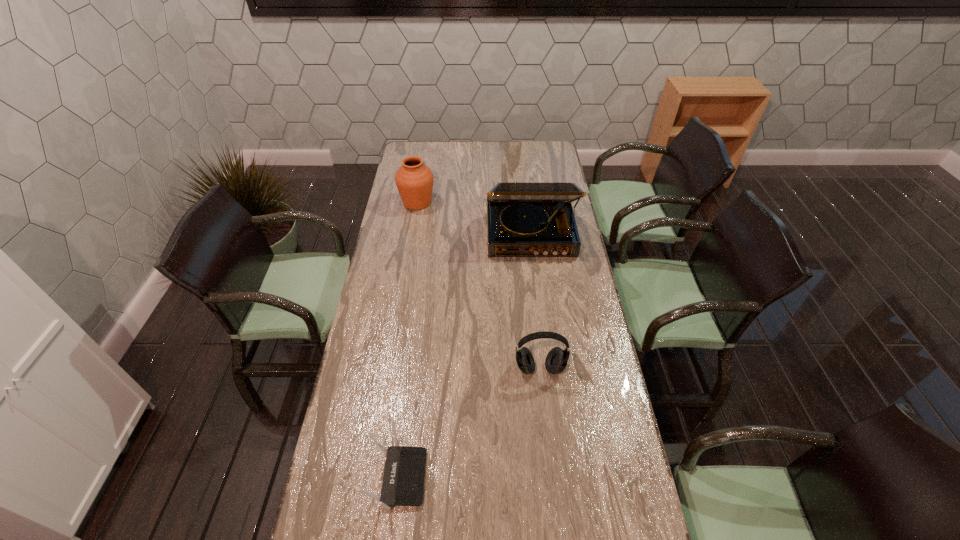
At what (x,y) coordinates should I click in order to perform the action: click on object that is the nearest to the farthest object. Please return your answer as a coordinate pair (x, y). Looking at the image, I should click on (524, 219).

Choose which object is the second nearest neighbor to the urn. Please provide its 2D coordinates. Your answer should be formatted as a tuple, i.e. [(x, y)], where the tuple contains the x and y coordinates of a point satisfying the conditions above.

[(556, 361)]

At what (x,y) coordinates should I click in order to perform the action: click on free region that satisfies the following two spatial constraints: 1. on the ear cups of the third farthest object; 2. on the front-facing side of the nearest object. Please return your answer as a coordinate pair (x, y). The image size is (960, 540). Looking at the image, I should click on (552, 477).

Locate an element on the screen. This screenshot has height=540, width=960. free space that satisfies the following two spatial constraints: 1. on the front-facing side of the tallest object; 2. on the front-facing side of the nearest object is located at coordinates (560, 477).

This screenshot has width=960, height=540. I want to click on free space that satisfies the following two spatial constraints: 1. on the ear cups of the second nearest object; 2. on the front-facing side of the router, so click(552, 477).

Locate an element on the screen. The image size is (960, 540). vacant region that satisfies the following two spatial constraints: 1. on the front-facing side of the third nearest object; 2. on the front-facing side of the shortest object is located at coordinates (560, 477).

Identify the location of vacant position in the image that satisfies the following two spatial constraints: 1. on the ear cups of the third tallest object; 2. on the front-facing side of the router. (552, 477).